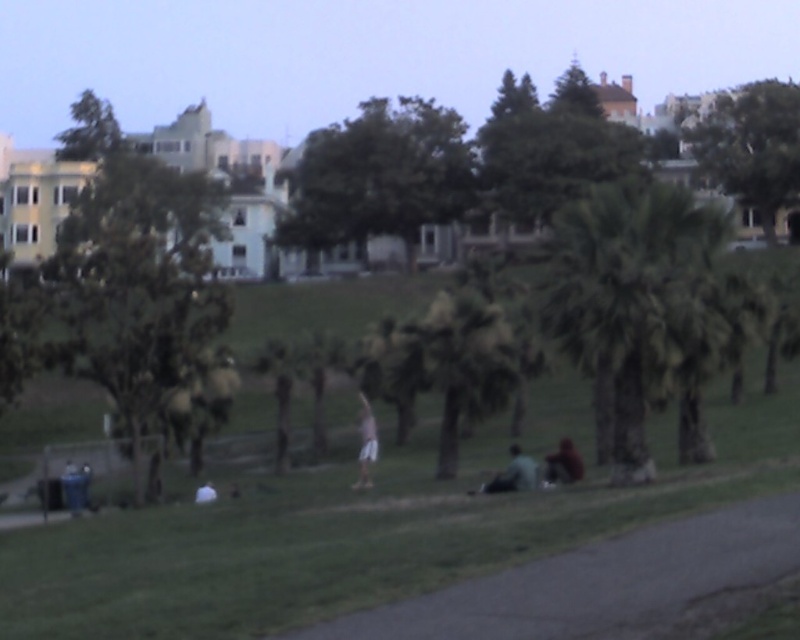
You are a hiker carrying a backpack that is 1 meter wide. You need to walk through the gap between the green leafy palm tree at right and the dark brown leather jacket at lower center. Can your backpack fit through the gap?

The green leafy palm tree at right might be wider than dark brown leather jacket at lower center, so the gap between them could be too narrow for a 1 meter wide backpack. It is uncertain if it will fit.